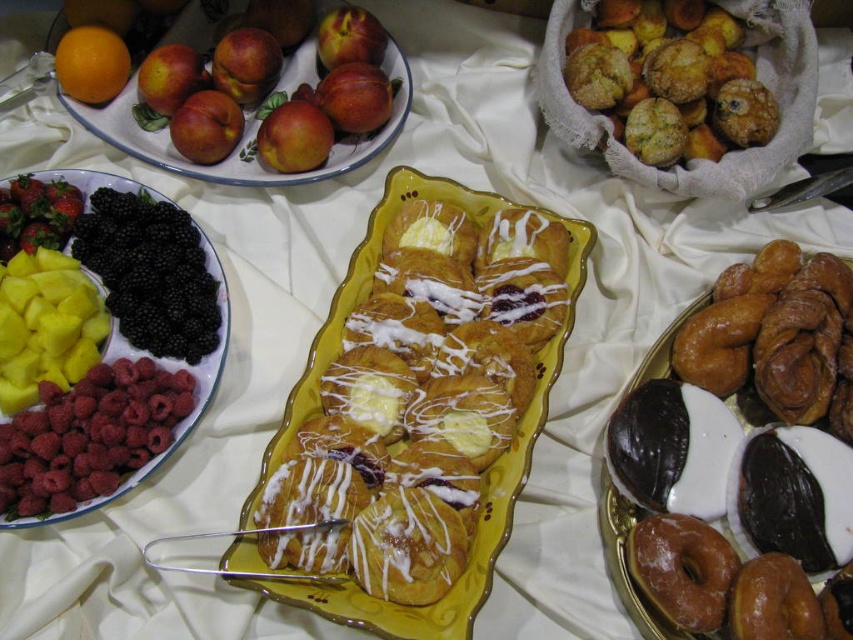
Does shiny ceramic plate at upper left have a greater height compared to shiny brown donut at lower right?

Yes.

Does shiny ceramic plate at upper left have a smaller size compared to shiny brown donut at lower right?

Actually, shiny ceramic plate at upper left might be larger than shiny brown donut at lower right.

You are a GUI agent. You are given a task and a screenshot of the screen. Output one action in this format:
    pyautogui.click(x=<x>, y=<y>)
    Task: Click on the shiny ceramic plate at upper left
    This screenshot has width=853, height=640.
    Given the screenshot: What is the action you would take?
    pyautogui.click(x=241, y=138)

Is yellow matte pineapple at left bigger than red matte apple at upper left?

Yes, yellow matte pineapple at left is bigger than red matte apple at upper left.

Is yellow matte pineapple at left closer to camera compared to red matte apple at upper left?

Yes, yellow matte pineapple at left is closer to the viewer.

In order to click on yellow matte pineapple at left in this screenshot , I will do tap(167, 369).

Does glazed doughnuts at right have a lesser height compared to shiny red strawberry at left?

No, glazed doughnuts at right is not shorter than shiny red strawberry at left.

The width and height of the screenshot is (853, 640). What do you see at coordinates (625, 561) in the screenshot? I see `glazed doughnuts at right` at bounding box center [625, 561].

Identify the location of glazed doughnuts at right. (625, 561).